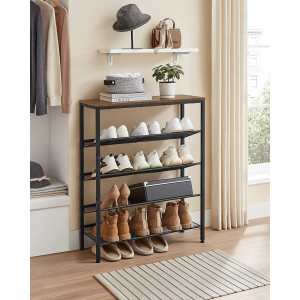
Where is `curtain folds`? Image resolution: width=300 pixels, height=300 pixels. curtain folds is located at coordinates (215, 83), (223, 84), (228, 85), (232, 85), (236, 86), (242, 87), (245, 87).